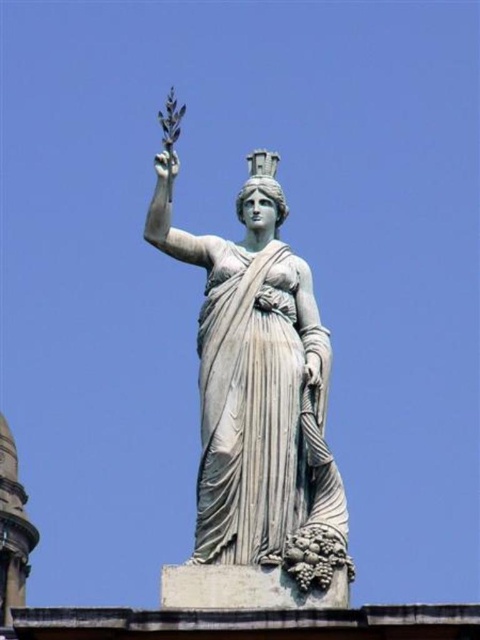
You are an art conservator examining the statue. You notice two hands on the statue. Which hand, the white marble hand at upper left or the matte gray hand at center, is positioned to the left of the other?

The white marble hand at upper left is positioned to the left of the matte gray hand at center.

You are an architect designing a new plaza and want to place a new fountain exactly 2 meters to the northeast of the white marble statue at center. Given the statue is at coordinates point 0.617, 0.542, what are the coordinates of the fountain?

The fountain would be placed at coordinates calculated by adding 2 meters northeast to the white marble statue at center. However, without knowing the scale of the coordinate system, precise coordinates can not be determined.

You are an art student analyzing the proportions of the white marble statue at center and the white marble hand at upper left in the image. Which object is significantly larger in size?

The white marble statue at center is much taller than the white marble hand at upper left, making it significantly larger in size.